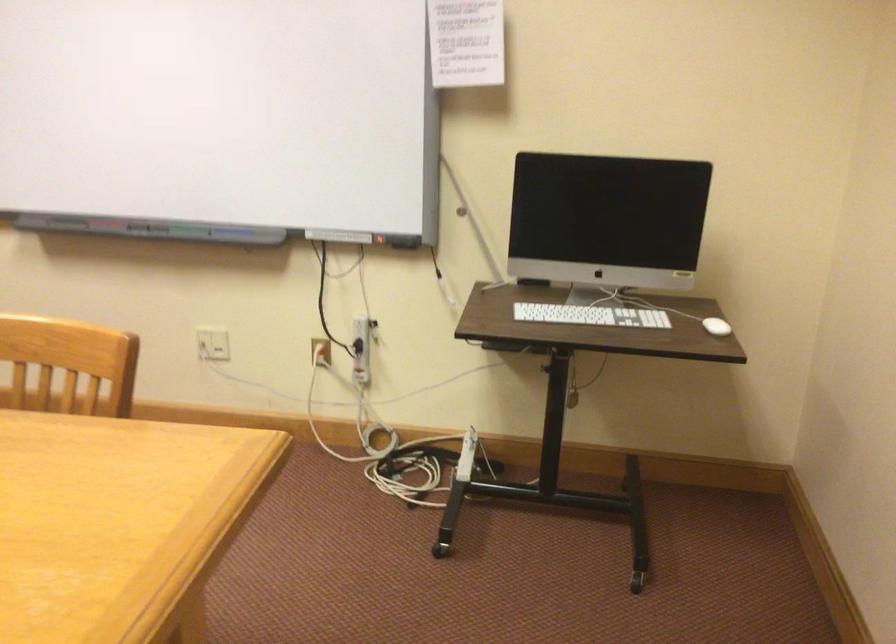
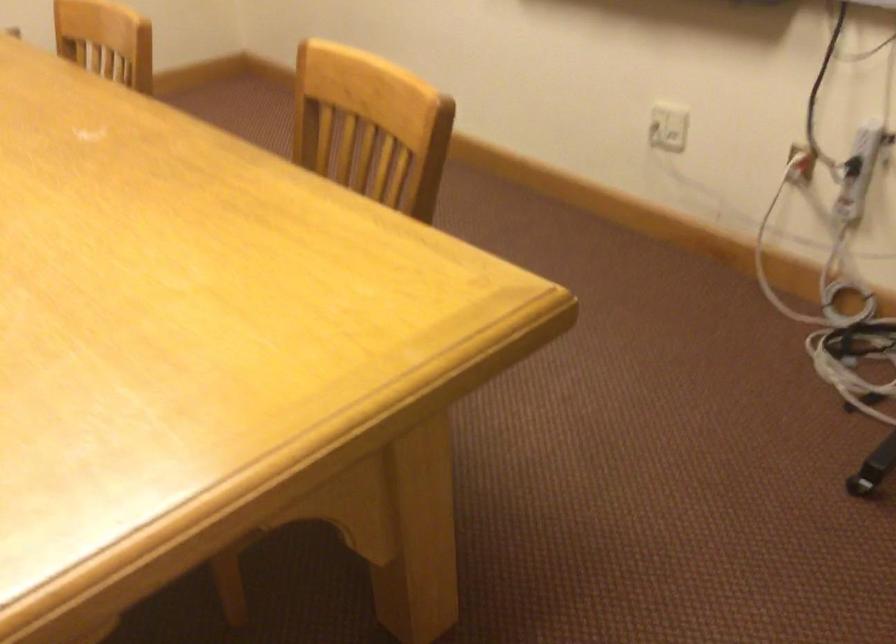
How did the camera likely rotate?

The rotation direction of the camera is left-down.